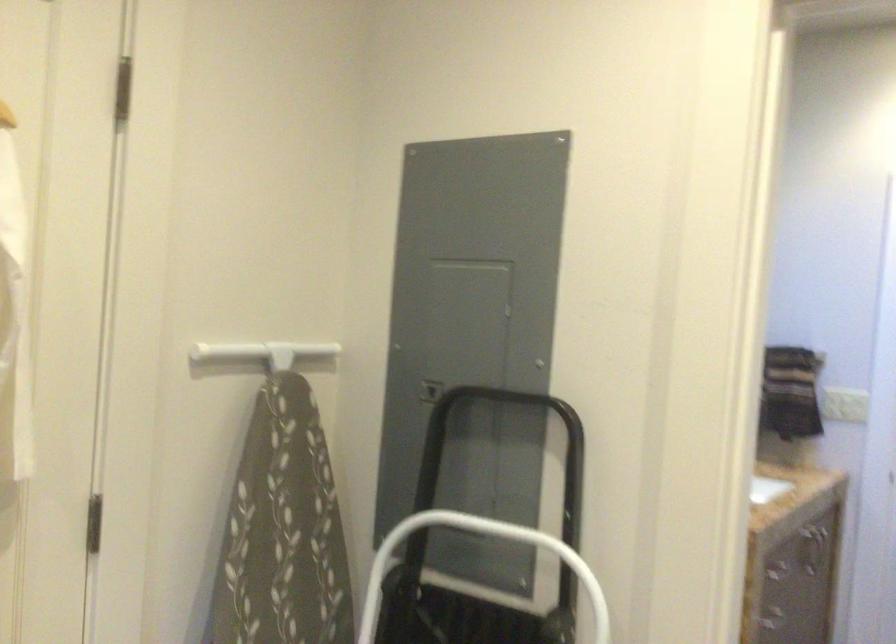
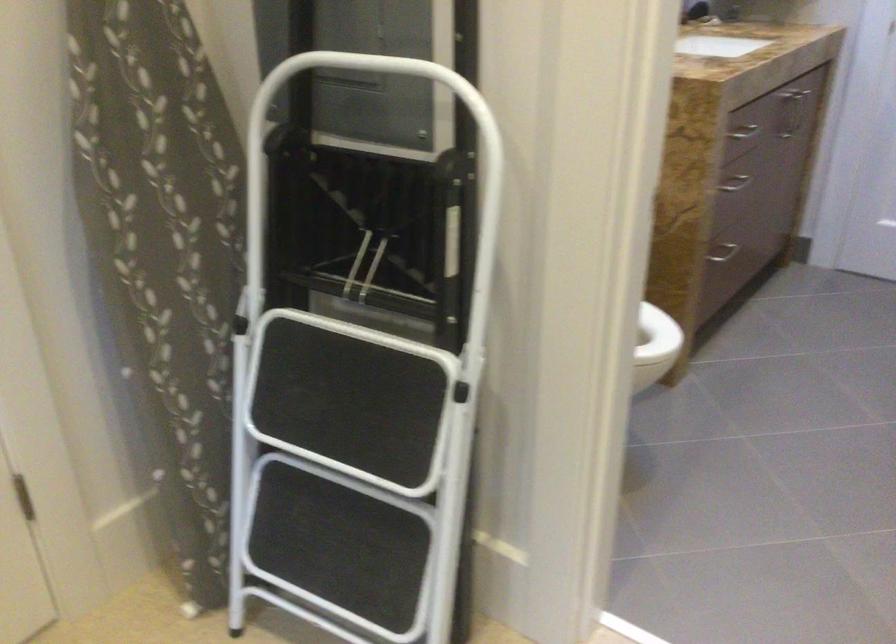
What movement of the cameraman would produce the second image?

The cameraman moved toward right, forward.